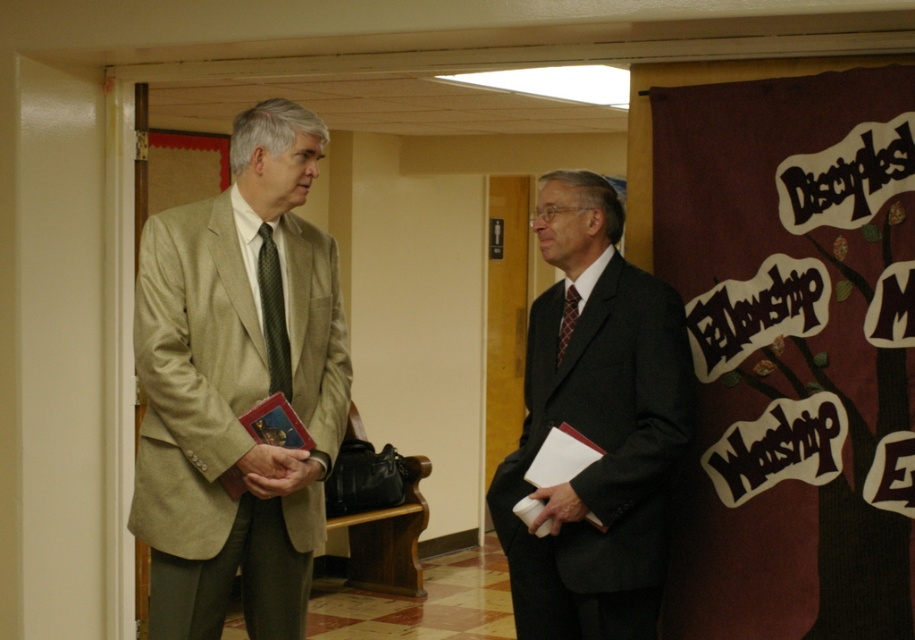
Does dark gray suit at center come in front of dark red textured tie at right?

Yes, dark gray suit at center is in front of dark red textured tie at right.

Can you confirm if dark gray suit at center is bigger than dark red textured tie at right?

Yes.

Between point (653, 301) and point (560, 326), which one is positioned in front?

Point (653, 301) is more forward.

Find the location of a particular element. This screenshot has width=915, height=640. dark gray suit at center is located at coordinates (596, 428).

Can you confirm if dark gray suit at center is positioned above green textured tie at left?

No, dark gray suit at center is not above green textured tie at left.

Which is above, dark gray suit at center or green textured tie at left?

green textured tie at left is higher up.

Image resolution: width=915 pixels, height=640 pixels. Describe the element at coordinates (596, 428) in the screenshot. I see `dark gray suit at center` at that location.

The height and width of the screenshot is (640, 915). In order to click on dark gray suit at center in this screenshot , I will do `click(596, 428)`.

Is point (218, 316) positioned in front of point (283, 385)?

Yes, it is in front of point (283, 385).

Between matte beige suit at left and green textured tie at left, which one is positioned higher?

green textured tie at left is higher up.

Who is more forward, [283,500] or [260,301]?

Positioned in front is point [283,500].

Locate an element on the screen. The width and height of the screenshot is (915, 640). matte beige suit at left is located at coordinates (237, 387).